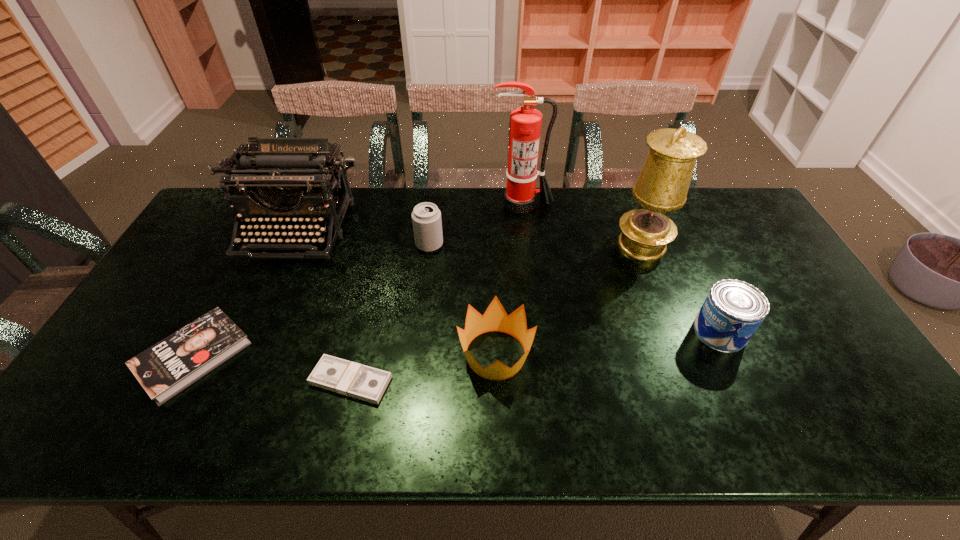
The image size is (960, 540). Find the location of `free spot at the far right corner of the desktop`. free spot at the far right corner of the desktop is located at coordinates (738, 208).

Find the location of a particular element. The height and width of the screenshot is (540, 960). vacant space that's between the shortest object and the fire extinguisher is located at coordinates (437, 292).

At what (x,y) coordinates should I click in order to perform the action: click on vacant space that is in between the right can and the typewriter. Please return your answer as a coordinate pair (x, y). Looking at the image, I should click on (508, 281).

You are a GUI agent. You are given a task and a screenshot of the screen. Output one action in this format:
    pyautogui.click(x=<x>, y=<y>)
    Task: Click on the empty space that is in between the crown and the left can
    The width and height of the screenshot is (960, 540).
    Given the screenshot: What is the action you would take?
    pyautogui.click(x=463, y=300)

Find the location of a particular element. This screenshot has width=960, height=540. free space between the nearer can and the third tallest object is located at coordinates (508, 281).

The width and height of the screenshot is (960, 540). I want to click on free space between the fire extinguisher and the left can, so click(476, 224).

This screenshot has width=960, height=540. Find the location of `free space between the right can and the book`. free space between the right can and the book is located at coordinates (457, 344).

Find the location of a particular element. free space between the second shortest object and the fire extinguisher is located at coordinates (358, 280).

Where is `free point between the fire extinguisher and the crown`? This screenshot has width=960, height=540. free point between the fire extinguisher and the crown is located at coordinates (509, 279).

Identify the location of empty location between the oil lamp and the crown. This screenshot has height=540, width=960. (568, 300).